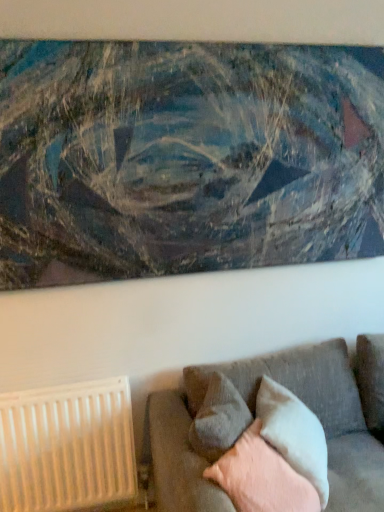
Question: Does textured canvas painting at upper center appear on the right side of gray fabric pillow at lower center, which is the 2th pillow in back-to-front order?

Choices:
 (A) no
 (B) yes

Answer: (A)

Question: Is textured canvas painting at upper center at the left side of gray fabric pillow at lower center, positioned as the 2th pillow in front-to-back order?

Choices:
 (A) yes
 (B) no

Answer: (A)

Question: From a real-world perspective, is textured canvas painting at upper center on gray fabric pillow at lower center, positioned as the 2th pillow in front-to-back order?

Choices:
 (A) yes
 (B) no

Answer: (A)

Question: Is textured canvas painting at upper center facing towards gray fabric pillow at lower center, which is the 2th pillow in back-to-front order?

Choices:
 (A) yes
 (B) no

Answer: (B)

Question: Are textured canvas painting at upper center and gray fabric pillow at lower center, which is the 2th pillow in back-to-front order, beside each other?

Choices:
 (A) yes
 (B) no

Answer: (B)

Question: From a real-world perspective, is textured canvas painting at upper center beneath gray fabric pillow at lower center, which is the 2th pillow in back-to-front order?

Choices:
 (A) yes
 (B) no

Answer: (B)

Question: From a real-world perspective, is textured gray couch at lower right beneath white plastic radiator at lower left?

Choices:
 (A) yes
 (B) no

Answer: (B)

Question: Can you confirm if textured gray couch at lower right is positioned to the right of white plastic radiator at lower left?

Choices:
 (A) yes
 (B) no

Answer: (A)

Question: Is textured gray couch at lower right further to the viewer compared to white plastic radiator at lower left?

Choices:
 (A) no
 (B) yes

Answer: (A)

Question: Is textured gray couch at lower right oriented towards white plastic radiator at lower left?

Choices:
 (A) yes
 (B) no

Answer: (B)

Question: Can we say textured gray couch at lower right lies outside white plastic radiator at lower left?

Choices:
 (A) no
 (B) yes

Answer: (B)

Question: Does textured gray couch at lower right have a greater width compared to white plastic radiator at lower left?

Choices:
 (A) yes
 (B) no

Answer: (A)

Question: Is gray fabric pillow at lower center, which is the 2th pillow in back-to-front order, taller than textured gray couch at lower right?

Choices:
 (A) no
 (B) yes

Answer: (A)